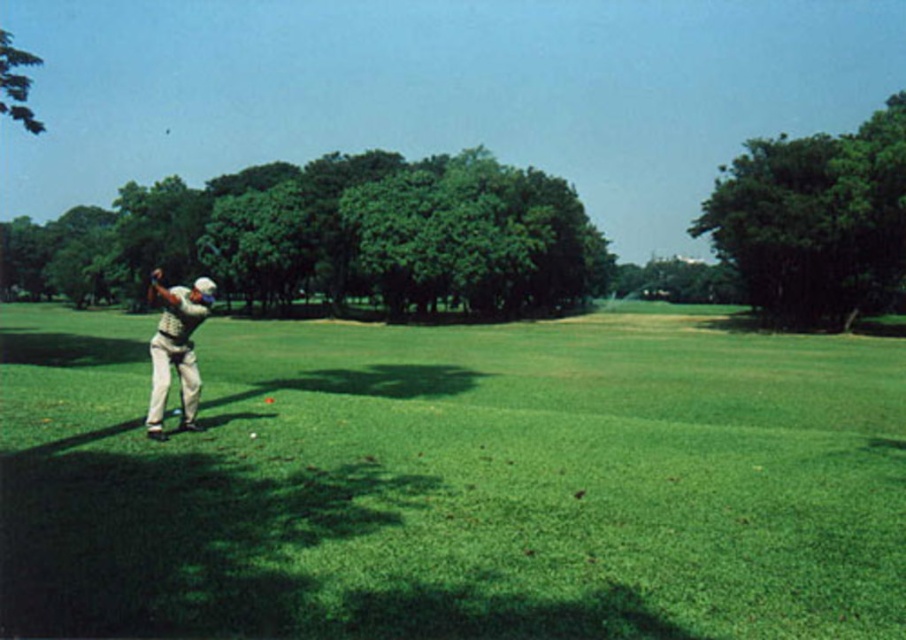
Can you confirm if green grass at left is thinner than white cotton shirt at left?

In fact, green grass at left might be wider than white cotton shirt at left.

Between green grass at left and white cotton shirt at left, which one is positioned lower?

green grass at left

Which is in front, point (476, 474) or point (174, 317)?

Positioned in front is point (476, 474).

You are a GUI agent. You are given a task and a screenshot of the screen. Output one action in this format:
    pyautogui.click(x=<x>, y=<y>)
    Task: Click on the green grass at left
    
    Given the screenshot: What is the action you would take?
    pos(453,483)